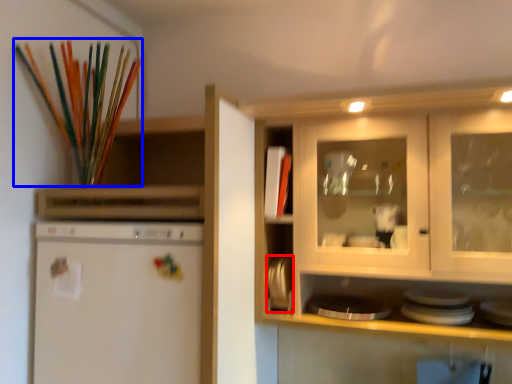
Question: Which of the following is the farthest to the observer, appliance (highlighted by a red box) or paint brush (highlighted by a blue box)?

Choices:
 (A) appliance
 (B) paint brush

Answer: (A)